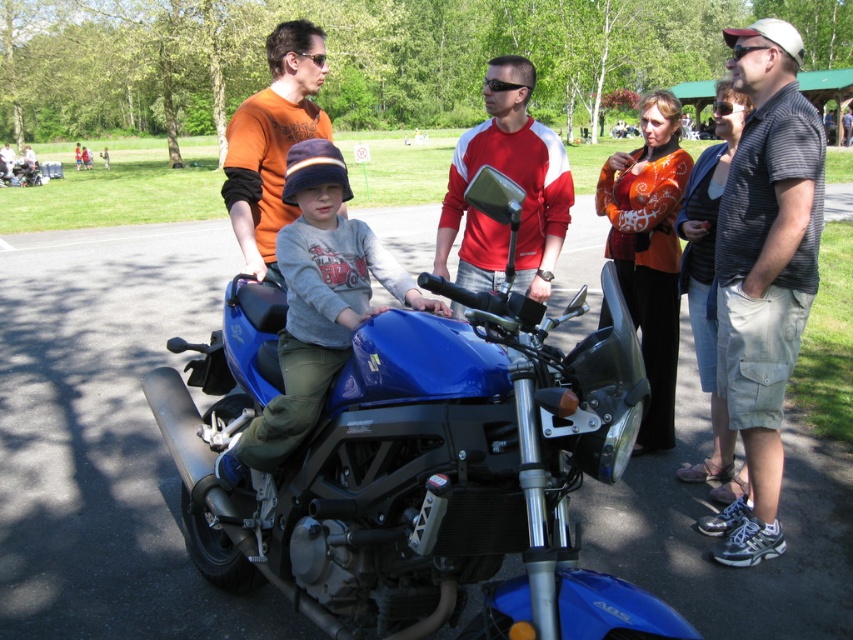
Question: Which object is the closest to the matte blue motorcycle at center?

Choices:
 (A) orange t-shirt at upper center
 (B) striped cotton shirt at right
 (C) blue matte motorcycle at center
 (D) red/white jersey at center

Answer: (C)

Question: Can you confirm if blue matte motorcycle at center is smaller than striped cotton shirt at right?

Choices:
 (A) yes
 (B) no

Answer: (B)

Question: Which point is closer to the camera?

Choices:
 (A) (535, 260)
 (B) (306, 106)
 (C) (363, 316)

Answer: (C)

Question: Which of the following is the farthest from the observer?

Choices:
 (A) (440, 212)
 (B) (380, 554)
 (C) (361, 268)

Answer: (A)

Question: Observing the image, what is the correct spatial positioning of blue matte motorcycle at center in reference to striped cotton shirt at right?

Choices:
 (A) above
 (B) below

Answer: (B)

Question: Is striped cotton shirt at right closer to the viewer compared to matte blue motorcycle at center?

Choices:
 (A) yes
 (B) no

Answer: (B)